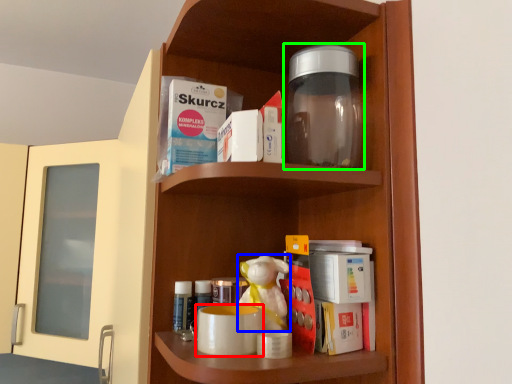
Question: Estimate the real-world distances between objects in this image. Which object is farther from mug (highlighted by a red box), toy (highlighted by a blue box) or bottle (highlighted by a green box)?

Choices:
 (A) toy
 (B) bottle

Answer: (B)